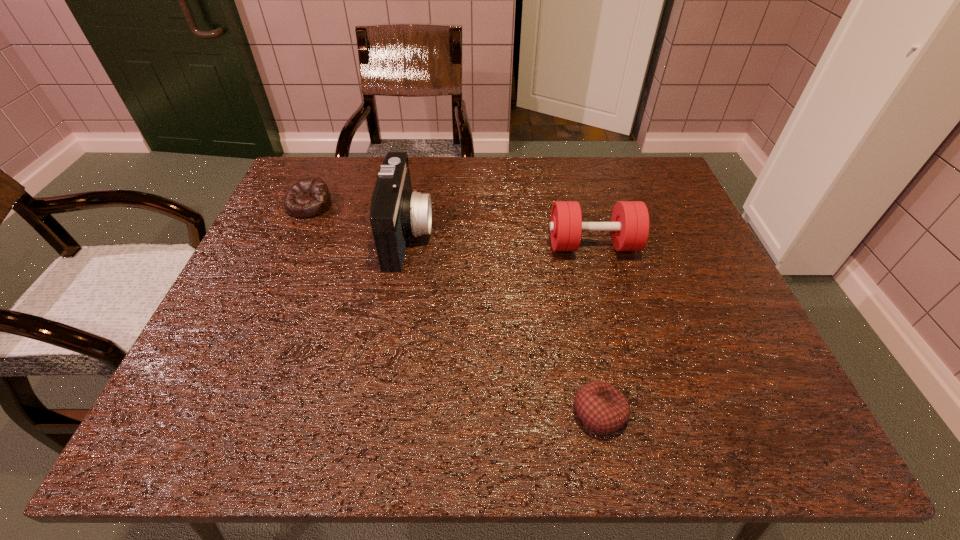
Locate an element on the screen. This screenshot has height=540, width=960. vacant space that's between the second tallest object and the third object from right to left is located at coordinates (500, 240).

Locate an element on the screen. The image size is (960, 540). free space between the dumbbell and the right beanbag is located at coordinates (596, 329).

I want to click on vacant point located between the nearer beanbag and the camcorder, so click(x=504, y=323).

Where is `vacant space that's between the second object from left to right and the right beanbag`? vacant space that's between the second object from left to right and the right beanbag is located at coordinates (504, 323).

The height and width of the screenshot is (540, 960). I want to click on the closest object relative to the right beanbag, so coord(629,226).

This screenshot has width=960, height=540. Identify the location of object that is the second closest to the dumbbell. (601, 407).

Find the location of `free space that satisfies the following two spatial constraints: 1. on the lens of the nearer beanbag; 2. on the right side of the third object from right to left`. free space that satisfies the following two spatial constraints: 1. on the lens of the nearer beanbag; 2. on the right side of the third object from right to left is located at coordinates (377, 413).

Locate an element on the screen. The width and height of the screenshot is (960, 540). vacant space that satisfies the following two spatial constraints: 1. on the lens of the nearer beanbag; 2. on the right side of the tallest object is located at coordinates (377, 413).

Locate an element on the screen. Image resolution: width=960 pixels, height=540 pixels. free space that satisfies the following two spatial constraints: 1. on the lens of the tallest object; 2. on the right side of the dumbbell is located at coordinates (406, 245).

Locate an element on the screen. This screenshot has height=540, width=960. blank space that satisfies the following two spatial constraints: 1. on the lens of the dumbbell; 2. on the left side of the camcorder is located at coordinates (406, 245).